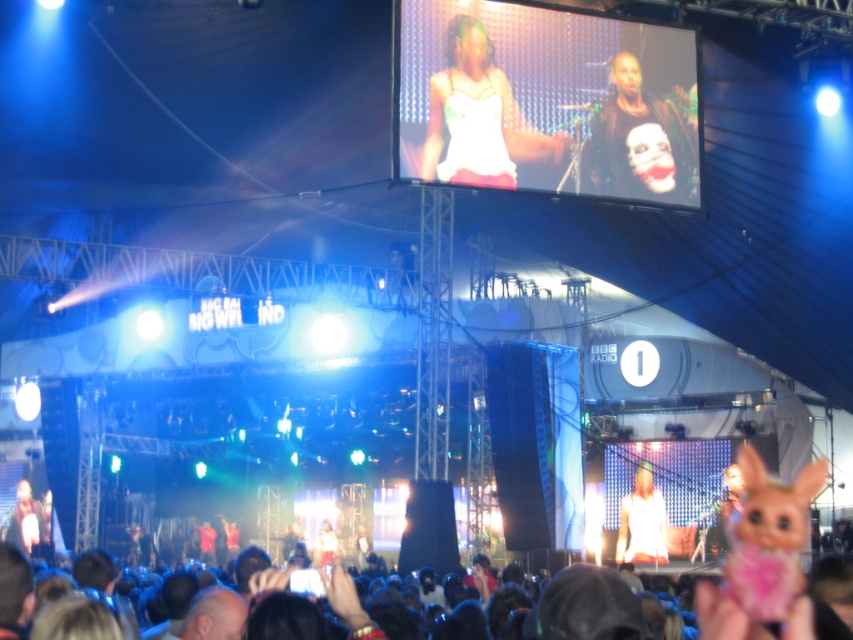
Does dark brown hair at lower center appear under matte black laptop at lower left?

No, dark brown hair at lower center is not below matte black laptop at lower left.

This screenshot has width=853, height=640. What do you see at coordinates (723, 616) in the screenshot? I see `dark brown hair at lower center` at bounding box center [723, 616].

Is point (809, 627) in front of point (19, 512)?

Yes, it is.

Identify the location of dark brown hair at lower center. The image size is (853, 640). (723, 616).

Is point (683, 144) behind point (648, 506)?

That is False.

Is black leather jacket at upper center positioned before white matte shirt at center?

Yes, black leather jacket at upper center is in front of white matte shirt at center.

Is point (614, 134) closer to viewer compared to point (630, 544)?

Yes, it is in front of point (630, 544).

The height and width of the screenshot is (640, 853). In order to click on black leather jacket at upper center in this screenshot , I will do `click(637, 140)`.

You are a GUI agent. You are given a task and a screenshot of the screen. Output one action in this format:
    pyautogui.click(x=<x>, y=<y>)
    Task: Click on the black leather jacket at upper center
    This screenshot has height=640, width=853.
    Given the screenshot: What is the action you would take?
    pyautogui.click(x=637, y=140)

The height and width of the screenshot is (640, 853). What are the coordinates of `black leather jacket at upper center` in the screenshot? It's located at (637, 140).